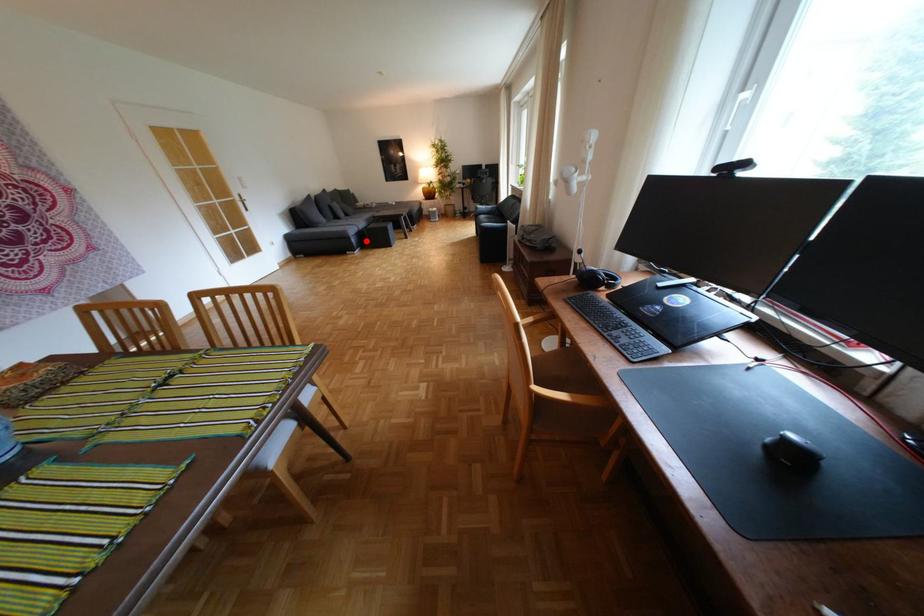
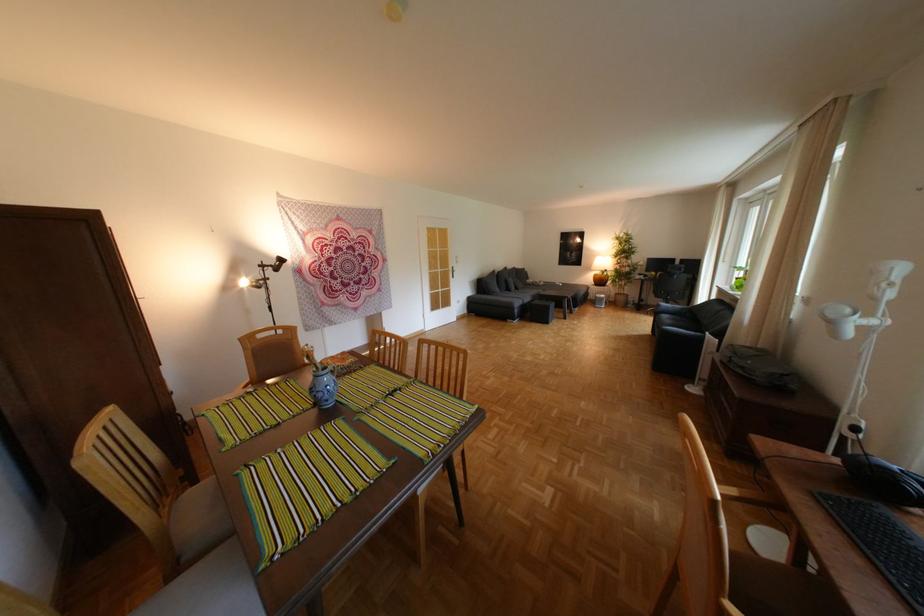
Question: I am providing you with two images of the same scene from different viewpoints. A red point is shown in image1. For the corresponding object point in image2, is it positioned nearer or farther from the camera?

Choices:
 (A) Nearer
 (B) Farther

Answer: (B)